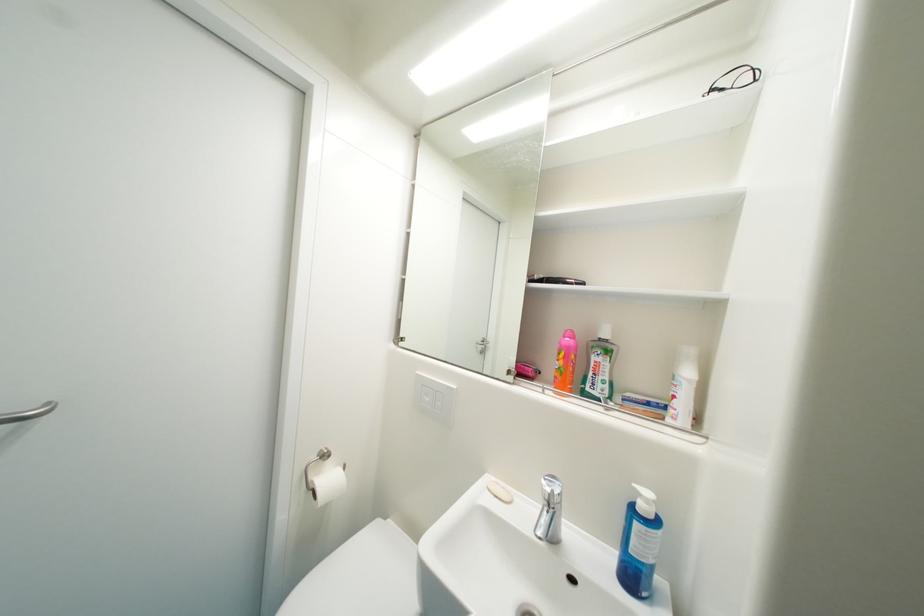
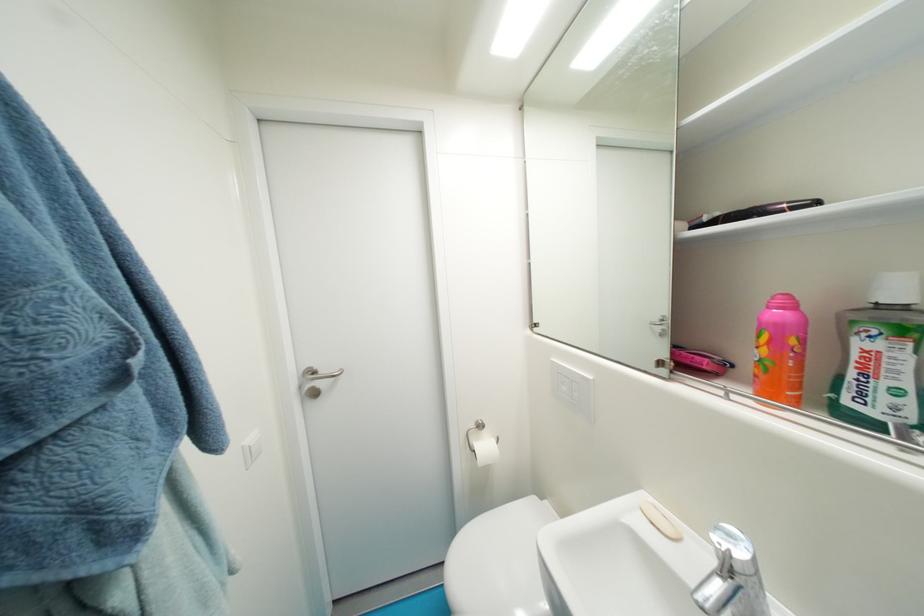
Question: I am providing you with two images of the same scene from different viewpoints. After the viewpoint changes to image2, which objects are now occluded?

Choices:
 (A) black electric device
 (B) bar of soap
 (C) pink and orange bottle
 (D) none of these

Answer: (D)